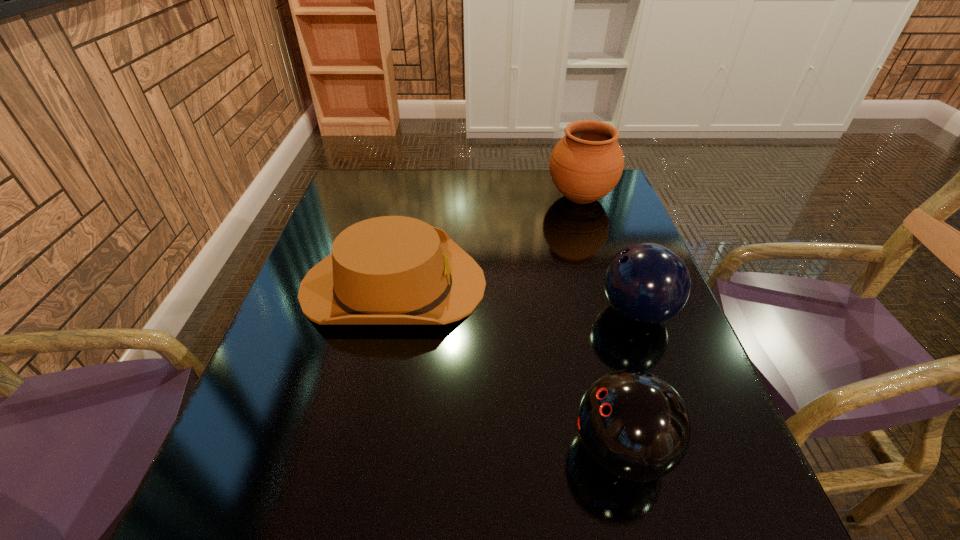
Where is `vacant space that is in between the farthest object and the farther bowling ball`? vacant space that is in between the farthest object and the farther bowling ball is located at coordinates (609, 255).

Identify the location of vacant area between the farthest object and the nearer bowling ball. The width and height of the screenshot is (960, 540). (601, 323).

Image resolution: width=960 pixels, height=540 pixels. Find the location of `vacant area between the leftmost object and the farther bowling ball`. vacant area between the leftmost object and the farther bowling ball is located at coordinates (516, 298).

At what (x,y) coordinates should I click in order to perform the action: click on free space between the farther bowling ball and the tallest object. Please return your answer as a coordinate pair (x, y). The image size is (960, 540). Looking at the image, I should click on (609, 255).

At what (x,y) coordinates should I click in order to perform the action: click on free point between the farther bowling ball and the tallest object. Please return your answer as a coordinate pair (x, y). This screenshot has width=960, height=540. Looking at the image, I should click on (609, 255).

Point out which object is positioned as the second nearest to the pottery. Please provide its 2D coordinates. Your answer should be formatted as a tuple, i.e. [(x, y)], where the tuple contains the x and y coordinates of a point satisfying the conditions above.

[(647, 283)]

Select which object appears as the closest to the tallest object. Please provide its 2D coordinates. Your answer should be formatted as a tuple, i.e. [(x, y)], where the tuple contains the x and y coordinates of a point satisfying the conditions above.

[(391, 270)]

Locate an element on the screen. This screenshot has height=540, width=960. free region that satisfies the following two spatial constraints: 1. on the front side of the pottery; 2. on the surface of the nearer bowling ball near the finger holes is located at coordinates [660, 449].